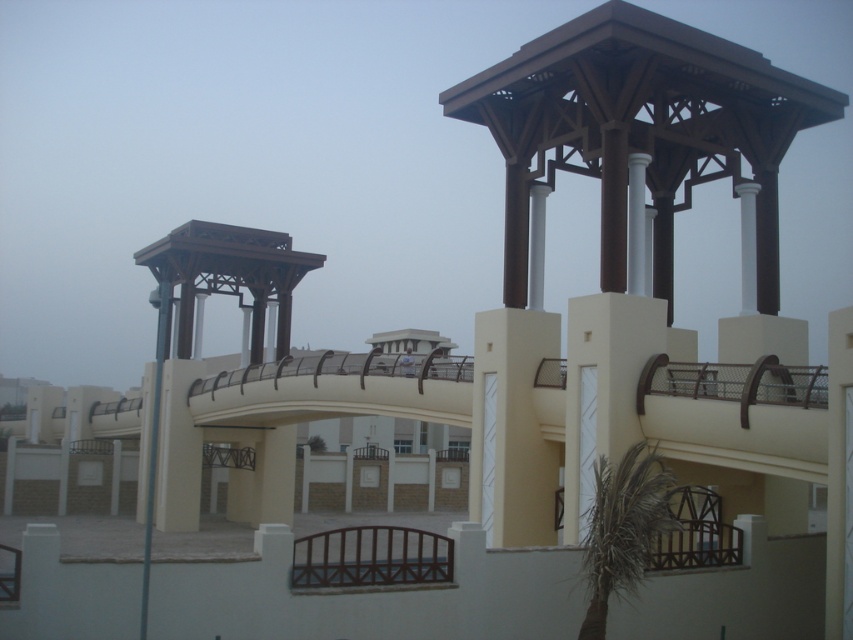
Which is above, green leafy palm tree at lower right or metallic pole at left?

metallic pole at left is higher up.

Is green leafy palm tree at lower right further to camera compared to metallic pole at left?

No, it is in front of metallic pole at left.

Where is `green leafy palm tree at lower right`? green leafy palm tree at lower right is located at coordinates (624, 529).

Where is `green leafy palm tree at lower right`? This screenshot has width=853, height=640. green leafy palm tree at lower right is located at coordinates (624, 529).